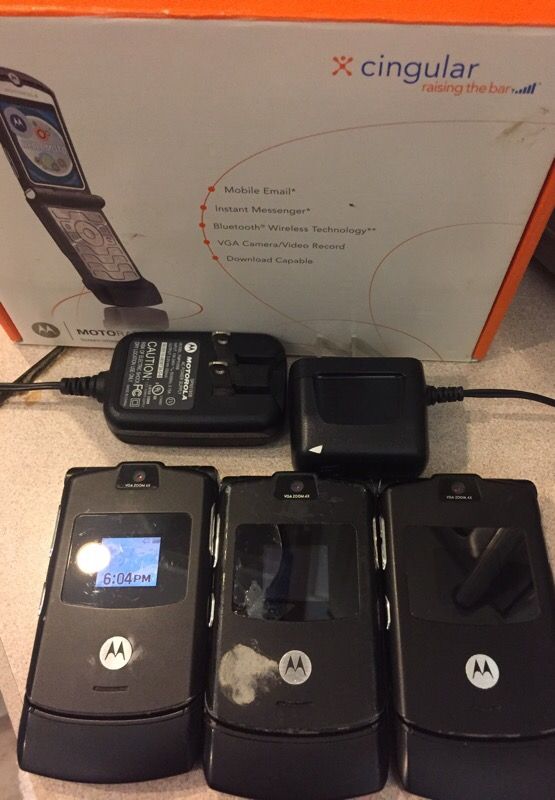
I want to click on plugs, so click(x=220, y=373), click(x=333, y=365).